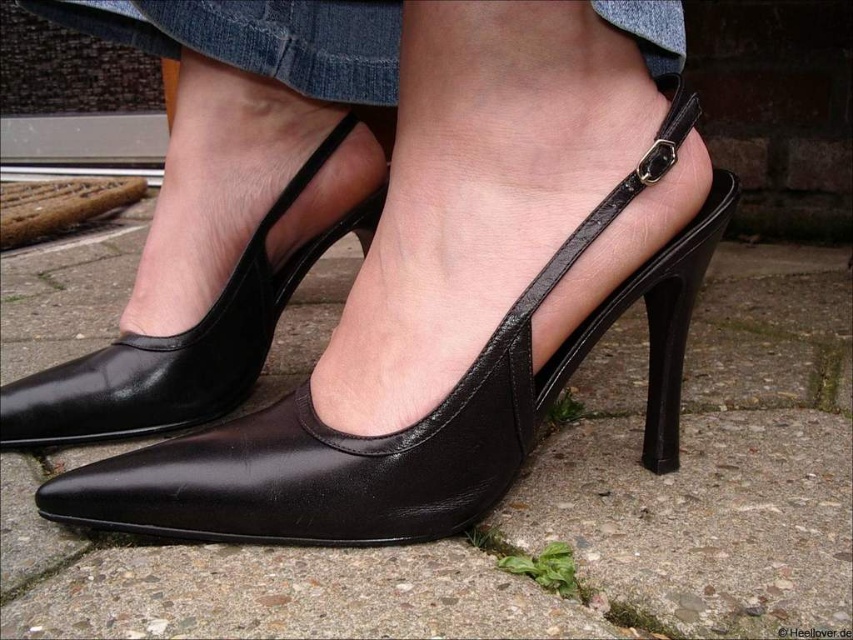
You are a photographer trying to capture the black leather sandal at center and the black leather shoe at center in the image. Which one appears closer to the camera?

The black leather sandal at center appears closer to the camera because it is in front of the black leather shoe at center.

You are a shoe designer observing the image. You need to determine which footwear item has a wider base for stability. Which one is wider between the black leather sandal at center and the black leather shoe at center?

The black leather sandal at center is wider than the black leather shoe at center, so it has a wider base for stability.

You are a photographer trying to capture the black leather sandal at center and the black leather shoe at center in a symmetrical composition. Which object should you move to the left to achieve symmetry?

To achieve symmetry, you should move the black leather sandal at center to the left so it aligns with the black leather shoe at center, as the black leather sandal at center is currently to the right of the black leather shoe at center.